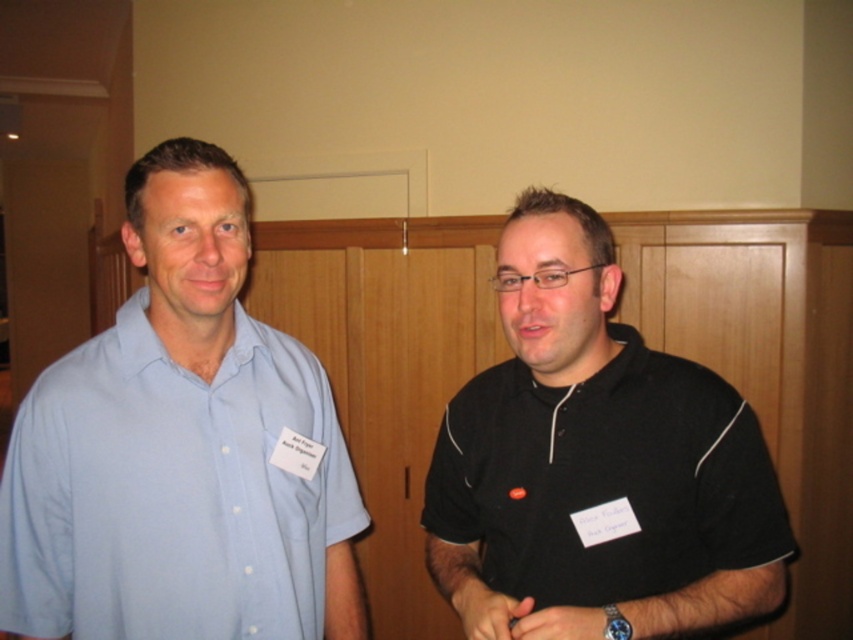
Can you confirm if black matte shirt at right is positioned above light blue cotton shirt at left?

Yes, black matte shirt at right is above light blue cotton shirt at left.

This screenshot has height=640, width=853. What do you see at coordinates (595, 465) in the screenshot? I see `black matte shirt at right` at bounding box center [595, 465].

You are a GUI agent. You are given a task and a screenshot of the screen. Output one action in this format:
    pyautogui.click(x=<x>, y=<y>)
    Task: Click on the black matte shirt at right
    This screenshot has width=853, height=640.
    Given the screenshot: What is the action you would take?
    pyautogui.click(x=595, y=465)